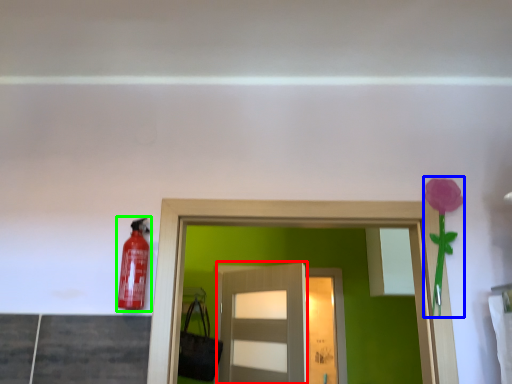
Question: Which is nearer to the door (highlighted by a red box)? flower (highlighted by a blue box) or extinguisher (highlighted by a green box).

Choices:
 (A) flower
 (B) extinguisher

Answer: (A)